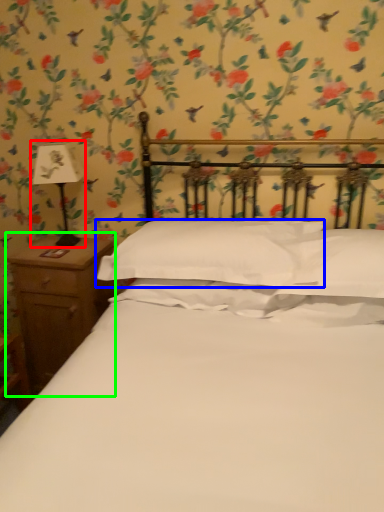
Question: Which object is positioned closest to bedside lamp (highlighted by a red box)? Select from pillow (highlighted by a blue box) and nightstand (highlighted by a green box).

Choices:
 (A) pillow
 (B) nightstand

Answer: (B)